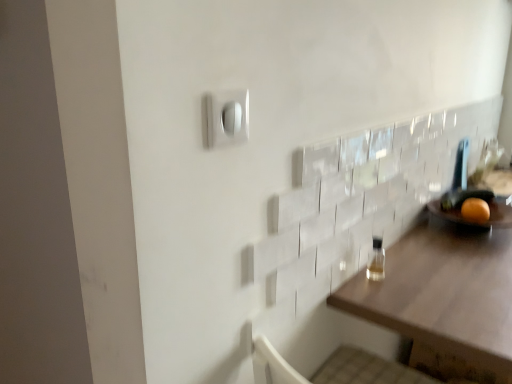
Where is `free point in front of clear glass bottle at right`? Image resolution: width=512 pixels, height=384 pixels. free point in front of clear glass bottle at right is located at coordinates (403, 306).